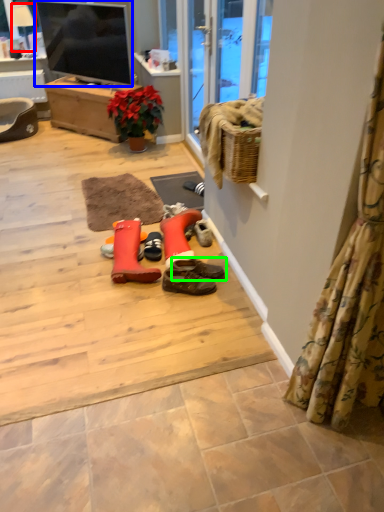
Question: Which object is positioned closest to lamp (highlighted by a red box)? Select from television (highlighted by a blue box) and footwear (highlighted by a green box).

Choices:
 (A) television
 (B) footwear

Answer: (A)